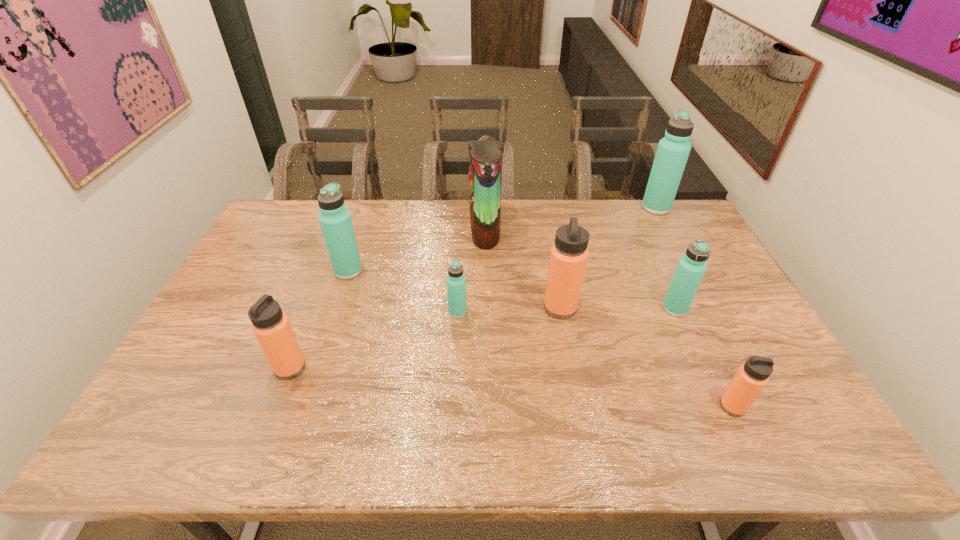
The height and width of the screenshot is (540, 960). In order to click on vacant space at the far left corner in this screenshot , I will do `click(288, 237)`.

The height and width of the screenshot is (540, 960). I want to click on vacant space at the near left corner of the desktop, so click(132, 438).

The image size is (960, 540). What are the coordinates of `free space at the near right corner of the desktop` in the screenshot? It's located at (792, 439).

What are the coordinates of `empty location between the second farthest orange thermos bottle and the nearest orange thermos bottle` in the screenshot? It's located at (512, 387).

Identify the location of vacant space that is in between the second biggest aqua thermos bottle and the nearest object. This screenshot has height=540, width=960. (540, 339).

Locate an element on the screen. Image resolution: width=960 pixels, height=540 pixels. vacant space that's between the third aqua thermos bottle from right to left and the third smallest aqua thermos bottle is located at coordinates (403, 292).

The width and height of the screenshot is (960, 540). What are the coordinates of `blank region between the smallest orange thermos bottle and the parrot` in the screenshot? It's located at (609, 318).

Locate an element on the screen. vacant point located between the smallest aqua thermos bottle and the fourth thermos bottle from left to right is located at coordinates 509,310.

Where is `vacant area that lies between the parrot and the smallest orange thermos bottle`? The height and width of the screenshot is (540, 960). vacant area that lies between the parrot and the smallest orange thermos bottle is located at coordinates (609, 318).

Locate an element on the screen. Image resolution: width=960 pixels, height=540 pixels. vacant region between the sixth farthest thermos bottle and the fifth object from left to right is located at coordinates (425, 338).